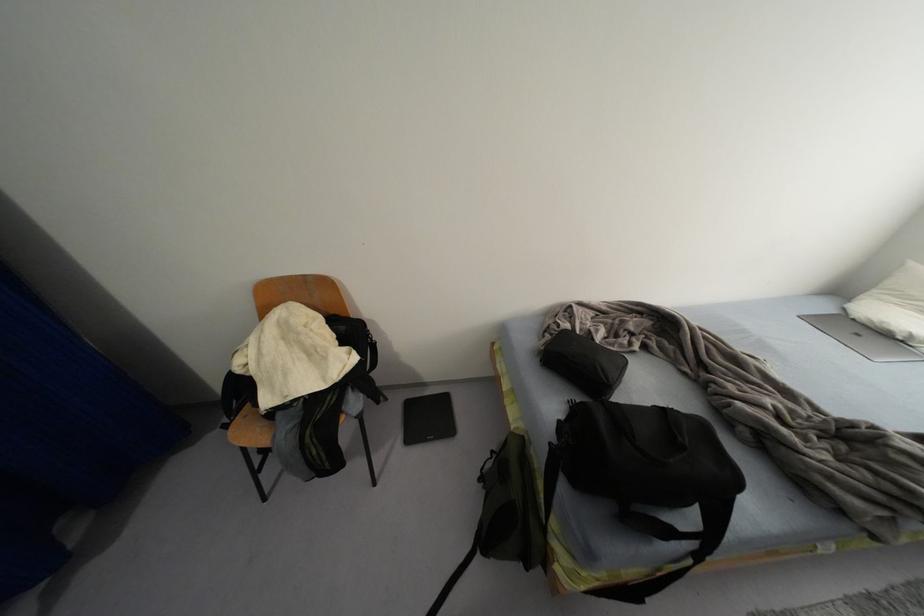
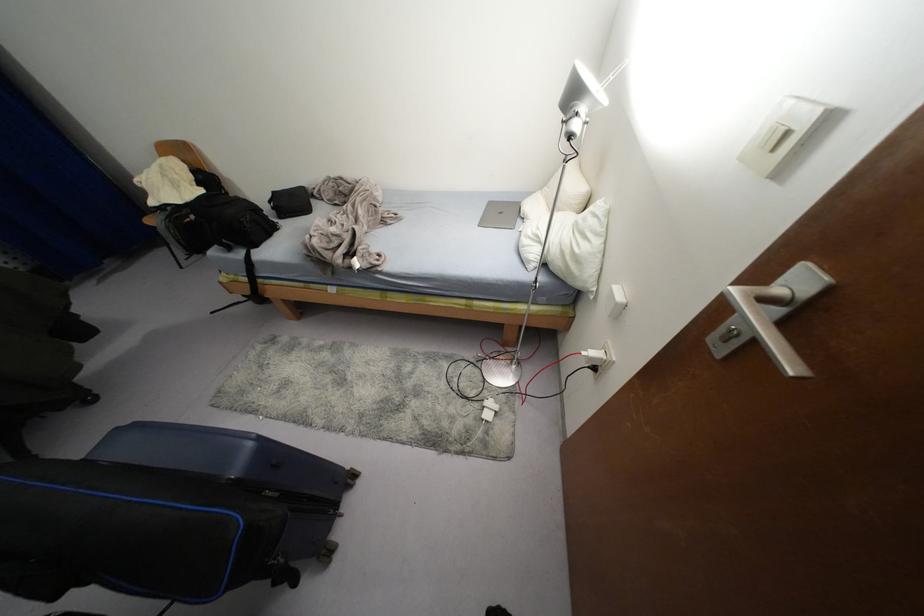
The point at (x=856, y=334) is marked in the first image. Where is the corresponding point in the second image?

(500, 213)